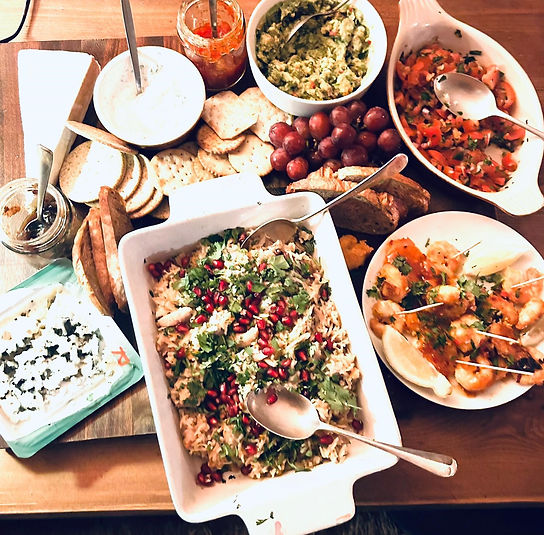
Locate an element on the screen. The height and width of the screenshot is (535, 544). serving spoons is located at coordinates (486, 104), (293, 416), (290, 221), (127, 24), (44, 156), (311, 17).